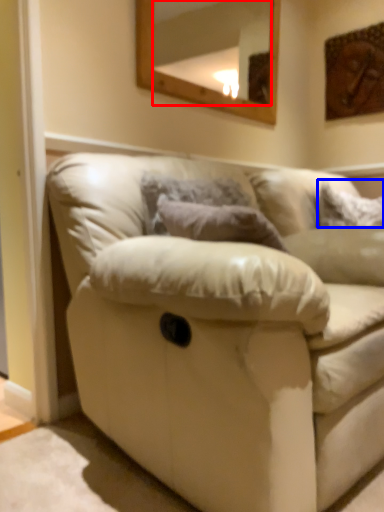
Question: Which object is further to the camera taking this photo, mirror (highlighted by a red box) or pillow (highlighted by a blue box)?

Choices:
 (A) mirror
 (B) pillow

Answer: (B)